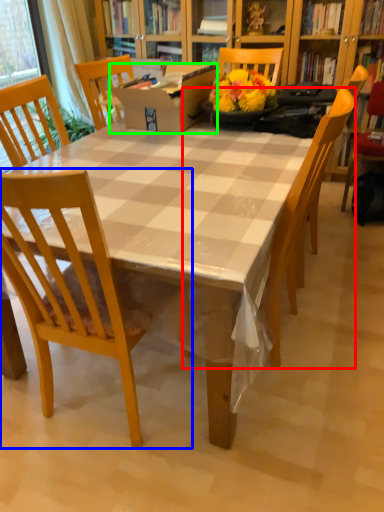
Question: Which object is the closest to the chair (highlighted by a red box)? Choose among these: chair (highlighted by a blue box) or box (highlighted by a green box).

Choices:
 (A) chair
 (B) box

Answer: (A)